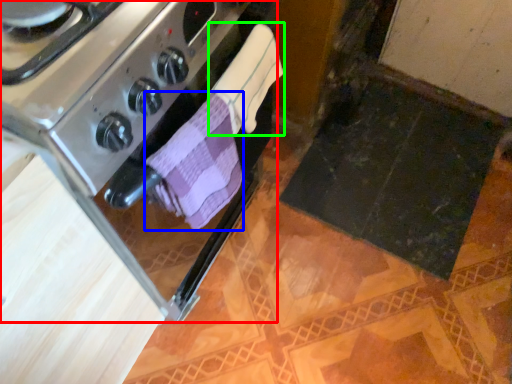
Question: Which is farther away from kitchen appliance (highlighted by a red box)? bath towel (highlighted by a blue box) or bath towel (highlighted by a green box)?

Choices:
 (A) bath towel
 (B) bath towel

Answer: (B)